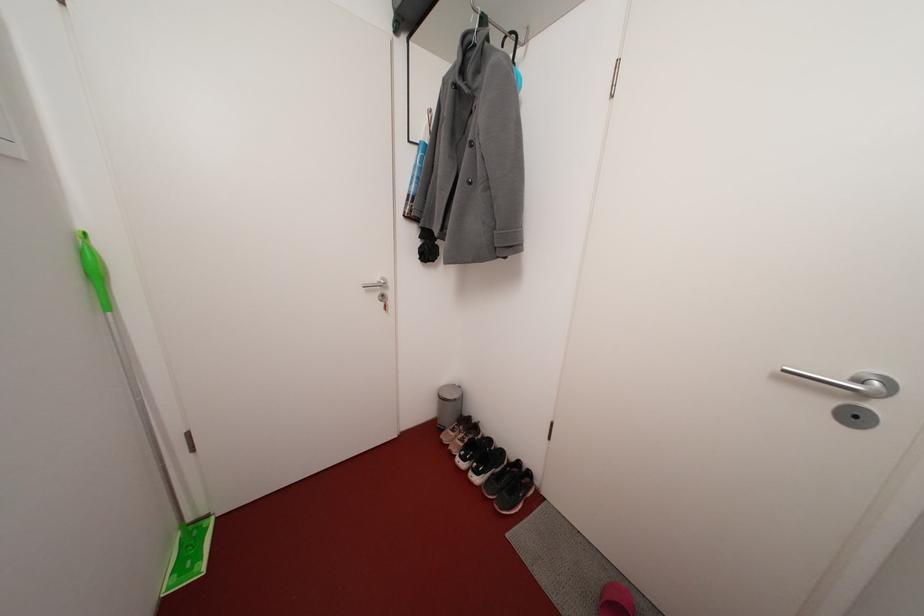
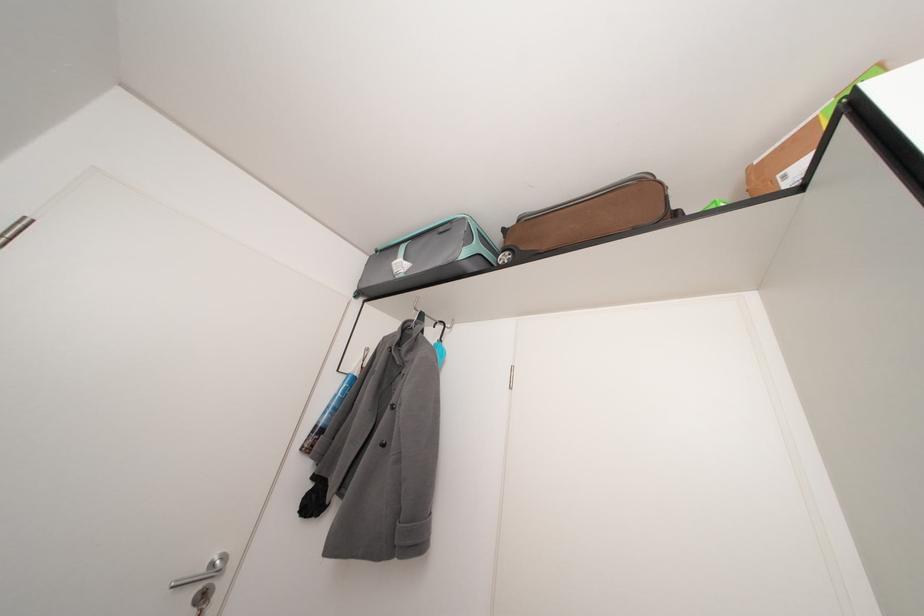
How did the camera likely rotate?

The rotation direction of the camera is right-up.